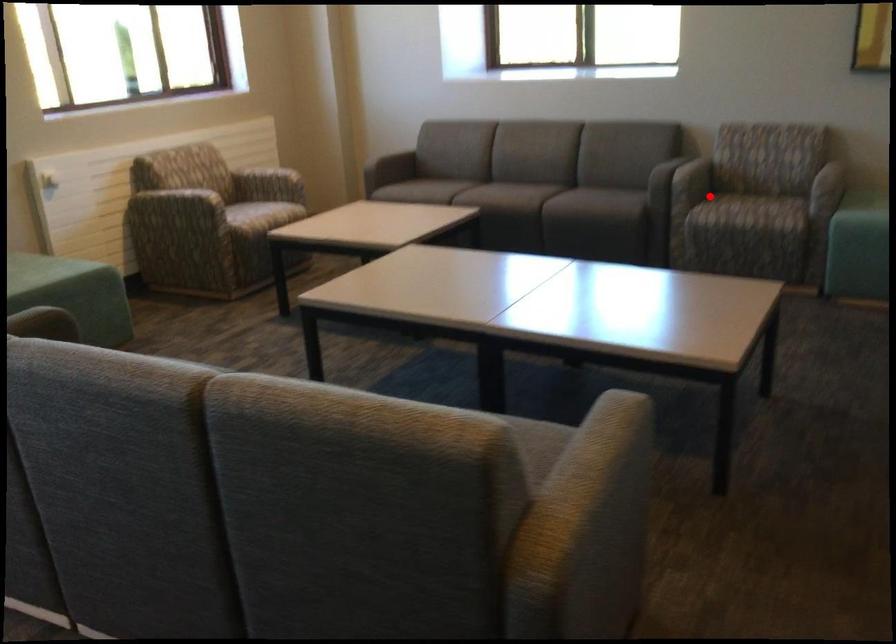
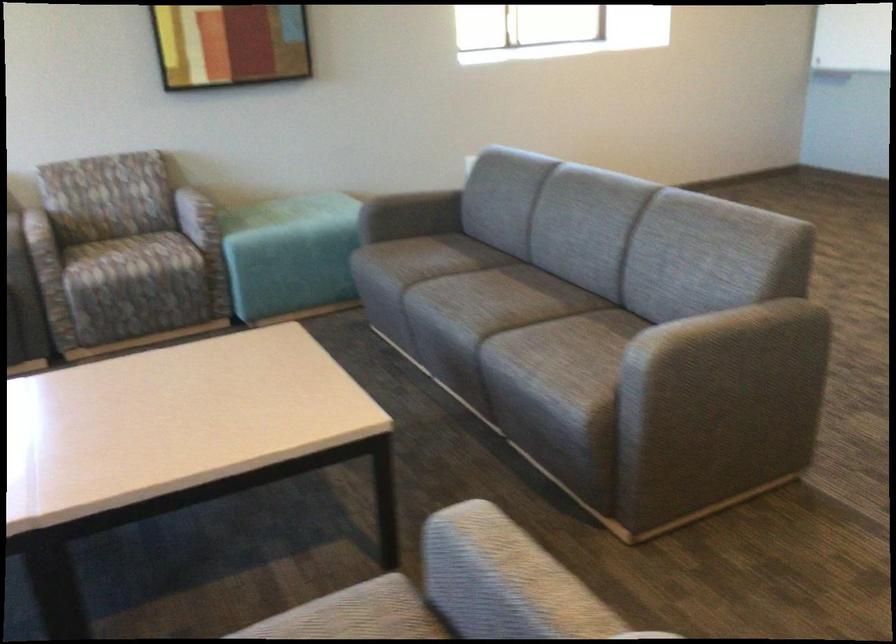
Locate, in the second image, the point that corresponds to the highlighted location in the first image.

(125, 259)